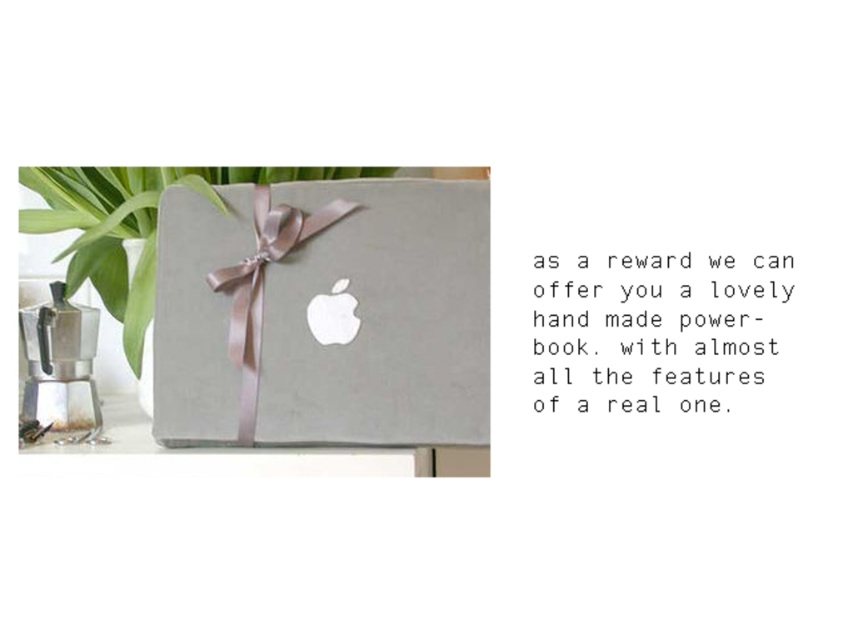
You are wrapping a gift and want to ensure the satin gray box at center is visible. Since the silky pink ribbon at center is covering part of it, where should you adjust the ribbon to make the box more visible?

The satin gray box at center is positioned under the silky pink ribbon at center, so adjusting the ribbon upwards would expose more of the box.

You are a delivery person who needs to place a 6 cm wide package between the satin gray box at center and the silky pink ribbon at center. Can you fit it there?

The satin gray box at center and silky pink ribbon at center are 5.36 centimeters apart, so the 6 cm wide package cannot fit between them since it is wider than the available space.

You are holding a gift and need to determine if the satin gray box at center is in front of the silky pink ribbon at center. Based on the scene, can you confirm this?

The satin gray box at center is closer to the viewer than the silky pink ribbon at center, so yes, the satin gray box at center is in front of the silky pink ribbon at center.